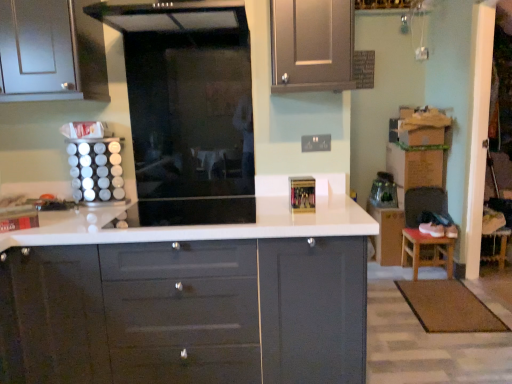
In order to click on free point below brown wooden stool at lower right (from a real-world perspective) in this screenshot , I will do `click(430, 271)`.